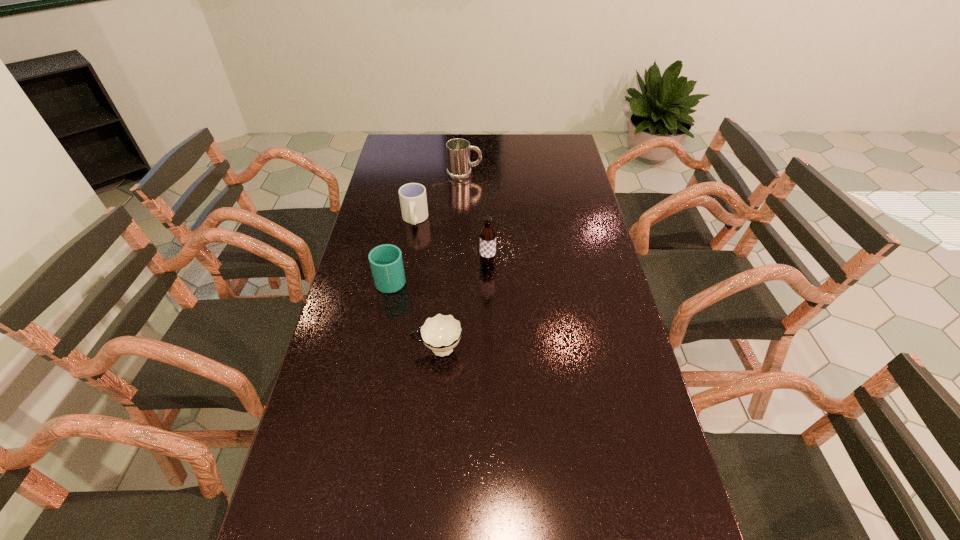
The height and width of the screenshot is (540, 960). Find the location of `blank region between the root beer and the fifth nearest object`. blank region between the root beer and the fifth nearest object is located at coordinates (451, 242).

Find the location of `blank region between the second nearest cup and the mug`. blank region between the second nearest cup and the mug is located at coordinates (428, 227).

The width and height of the screenshot is (960, 540). What are the coordinates of `free spot between the second farthest cup and the nearest cup` in the screenshot? It's located at 415,315.

This screenshot has height=540, width=960. What are the coordinates of `empty location between the rightmost cup and the fifth nearest object` in the screenshot? It's located at (426, 285).

Where is `unoccupied area between the root beer and the second nearest object`? This screenshot has height=540, width=960. unoccupied area between the root beer and the second nearest object is located at coordinates (463, 307).

Identify which object is the second nearest to the rightmost object. Please provide its 2D coordinates. Your answer should be formatted as a tuple, i.e. [(x, y)], where the tuple contains the x and y coordinates of a point satisfying the conditions above.

[(487, 252)]

Where is `the closest object relative to the farthest cup`? the closest object relative to the farthest cup is located at coordinates (386, 262).

Locate an element on the screen. This screenshot has width=960, height=540. cup that is the closest to the nearest object is located at coordinates (441, 333).

This screenshot has width=960, height=540. I want to click on the closest cup to the farthest cup, so click(x=386, y=262).

Where is `free point that satisfies the following two spatial constraints: 1. with the handle on the side of the farthest cup; 2. on the side of the fifth tallest object with the handle`? The height and width of the screenshot is (540, 960). free point that satisfies the following two spatial constraints: 1. with the handle on the side of the farthest cup; 2. on the side of the fifth tallest object with the handle is located at coordinates (393, 350).